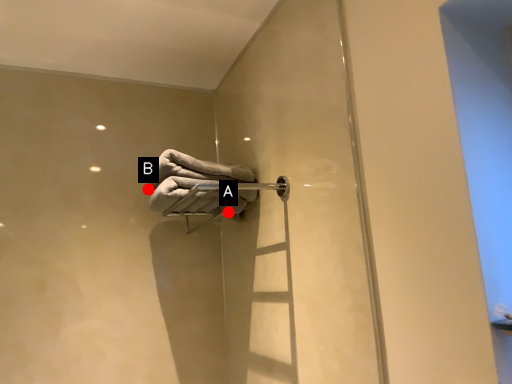
Question: Two points are circled on the image, labeled by A and B beside each circle. Which point is farther to the camera?

Choices:
 (A) A is further
 (B) B is further

Answer: (B)